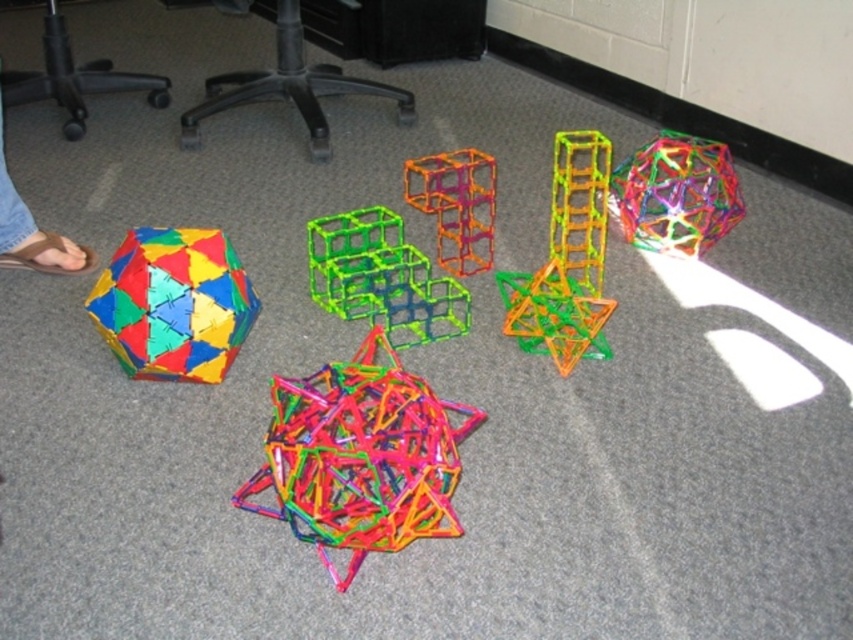
Which of these two, translucent multicolored sphere at center or translucent orange cube at center, stands taller?

Standing taller between the two is translucent orange cube at center.

Can you confirm if translucent multicolored sphere at center is wider than translucent orange cube at center?

Yes.

This screenshot has height=640, width=853. In order to click on translucent multicolored sphere at center in this screenshot , I will do `click(676, 195)`.

At what (x,y) coordinates should I click in order to perform the action: click on translucent multicolored sphere at center. Please return your answer as a coordinate pair (x, y). Looking at the image, I should click on (676, 195).

Is point (485, 177) farther from camera compared to point (550, 220)?

Yes, point (485, 177) is behind point (550, 220).

The height and width of the screenshot is (640, 853). Find the location of `translucent orange cube at center`. translucent orange cube at center is located at coordinates (456, 205).

Does translucent plastic star at center appear on the right side of brown leather sandals at lower left?

Indeed, translucent plastic star at center is positioned on the right side of brown leather sandals at lower left.

Between translucent plastic star at center and brown leather sandals at lower left, which one appears on the left side from the viewer's perspective?

From the viewer's perspective, brown leather sandals at lower left appears more on the left side.

The height and width of the screenshot is (640, 853). In order to click on translucent plastic star at center in this screenshot , I will do `click(360, 458)`.